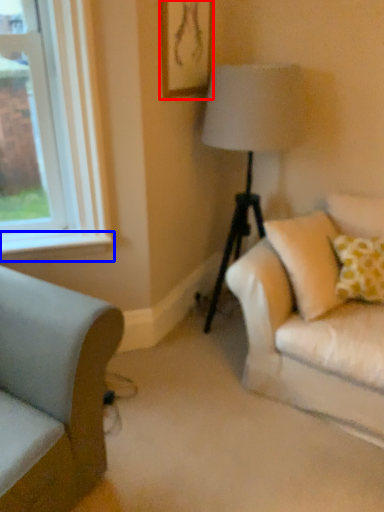
Question: Which object is further to the camera taking this photo, picture frame (highlighted by a red box) or window sill (highlighted by a blue box)?

Choices:
 (A) picture frame
 (B) window sill

Answer: (B)